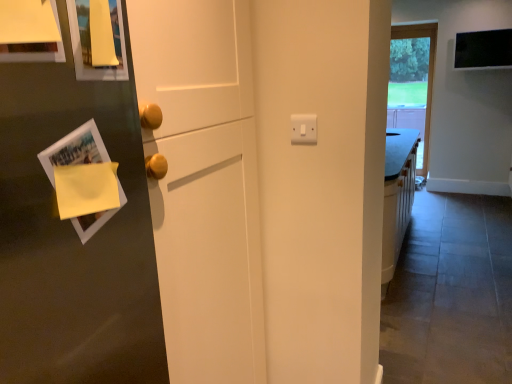
Measure the distance between point (421, 110) and camera.

Point (421, 110) and camera are 6.39 meters apart.

The image size is (512, 384). In order to click on transparent glass window at upper right in this screenshot , I will do `click(412, 82)`.

Describe the element at coordinates (412, 82) in the screenshot. I see `transparent glass window at upper right` at that location.

The image size is (512, 384). What do you see at coordinates (75, 150) in the screenshot?
I see `yellow paper at left` at bounding box center [75, 150].

Where is `yellow paper at left`? The height and width of the screenshot is (384, 512). yellow paper at left is located at coordinates (75, 150).

At what (x,y) coordinates should I click in order to perform the action: click on transparent glass window at upper right. Please return your answer as a coordinate pair (x, y). The height and width of the screenshot is (384, 512). Looking at the image, I should click on (412, 82).

Is transparent glass window at upper right at the right side of yellow paper at left?

Correct, you'll find transparent glass window at upper right to the right of yellow paper at left.

Considering the relative positions of transparent glass window at upper right and yellow paper at left in the image provided, is transparent glass window at upper right in front of yellow paper at left?

No, it is behind yellow paper at left.

Is point (423, 147) less distant than point (52, 161)?

No.

From the image's perspective, which object appears higher, transparent glass window at upper right or yellow paper at left?

transparent glass window at upper right, from the image's perspective.

In the scene shown: From a real-world perspective, is transparent glass window at upper right under yellow paper at left?

Yes, from a real-world perspective, transparent glass window at upper right is beneath yellow paper at left.

Consider the image. Considering the sizes of objects transparent glass window at upper right and yellow paper at left in the image provided, who is wider, transparent glass window at upper right or yellow paper at left?

Wider between the two is yellow paper at left.

Considering the sizes of transparent glass window at upper right and yellow paper at left in the image, is transparent glass window at upper right taller or shorter than yellow paper at left?

Clearly, transparent glass window at upper right is taller compared to yellow paper at left.

Is transparent glass window at upper right bigger than yellow paper at left?

Yes.

Which is correct: transparent glass window at upper right is inside yellow paper at left, or outside of it?

The correct answer is: outside.

Is transparent glass window at upper right placed right next to yellow paper at left?

No, transparent glass window at upper right is not making contact with yellow paper at left.

Is transparent glass window at upper right facing towards yellow paper at left?

Yes, transparent glass window at upper right is turned towards yellow paper at left.

What's the angular difference between transparent glass window at upper right and yellow paper at left's facing directions?

The angular difference between transparent glass window at upper right and yellow paper at left is 87.8 degrees.

How far apart are transparent glass window at upper right and yellow paper at left?

transparent glass window at upper right and yellow paper at left are 6.07 meters apart from each other.

At what (x,y) coordinates should I click in order to perform the action: click on magazine to the left of transparent glass window at upper right. Please return your answer as a coordinate pair (x, y). Image resolution: width=512 pixels, height=384 pixels. Looking at the image, I should click on (75, 150).

Visually, is yellow paper at left positioned to the left or to the right of transparent glass window at upper right?

yellow paper at left is to the left of transparent glass window at upper right.

Is the depth of yellow paper at left less than that of transparent glass window at upper right?

Yes, yellow paper at left is in front of transparent glass window at upper right.

Considering the points (88, 224) and (390, 78), which point is behind, point (88, 224) or point (390, 78)?

Point (390, 78)

From the image's perspective, is yellow paper at left beneath transparent glass window at upper right?

Result: Indeed, from the image's perspective, yellow paper at left is shown beneath transparent glass window at upper right.

From a real-world perspective, is yellow paper at left positioned above or below transparent glass window at upper right?

yellow paper at left is situated higher than transparent glass window at upper right in the real world.

In terms of width, does yellow paper at left look wider or thinner when compared to transparent glass window at upper right?

yellow paper at left is wider than transparent glass window at upper right.

Who is taller, yellow paper at left or transparent glass window at upper right?

With more height is transparent glass window at upper right.

Based on their sizes in the image, would you say yellow paper at left is bigger or smaller than transparent glass window at upper right?

In the image, yellow paper at left appears to be smaller than transparent glass window at upper right.

Is transparent glass window at upper right completely or partially inside yellow paper at left?

Actually, transparent glass window at upper right is outside yellow paper at left.

Is yellow paper at left next to transparent glass window at upper right and touching it?

No, yellow paper at left is not touching transparent glass window at upper right.

Is yellow paper at left facing away from transparent glass window at upper right?

No, yellow paper at left is not facing away from transparent glass window at upper right.

How many degrees apart are the facing directions of yellow paper at left and transparent glass window at upper right?

87.8 degrees separate the facing orientations of yellow paper at left and transparent glass window at upper right.

Find the location of a particular element. window above the yellow paper at left (from the image's perspective) is located at coordinates (412, 82).

In order to click on window below the yellow paper at left (from a real-world perspective) in this screenshot , I will do `click(412, 82)`.

This screenshot has width=512, height=384. In order to click on magazine above the transparent glass window at upper right (from a real-world perspective) in this screenshot , I will do `click(75, 150)`.